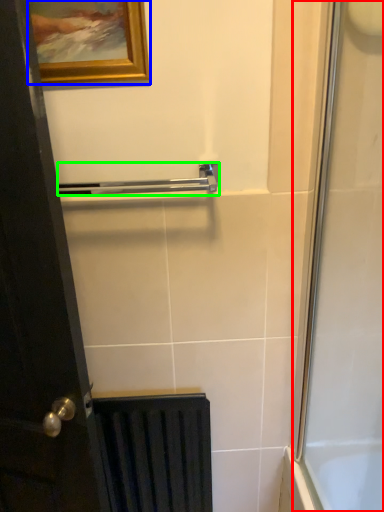
Question: Considering the real-world distances, which object is farthest from screen door (highlighted by a red box)? picture frame (highlighted by a blue box) or towel bar (highlighted by a green box)?

Choices:
 (A) picture frame
 (B) towel bar

Answer: (A)